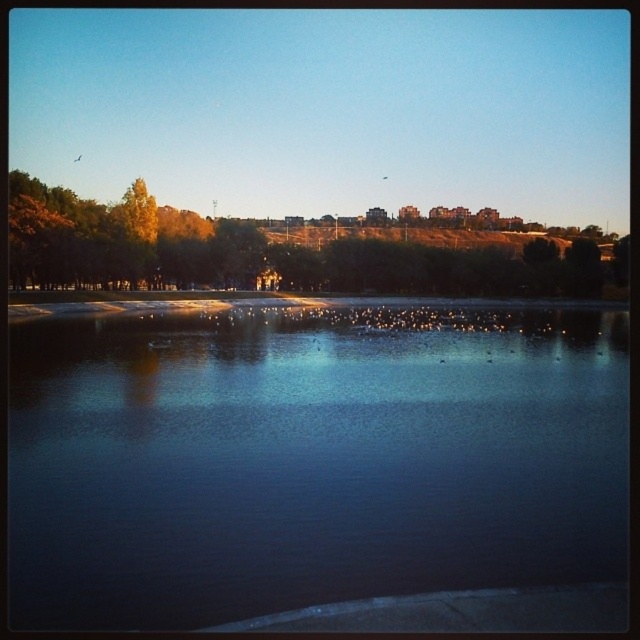
You are standing at the lakeside and want to take a photo that includes both the dark reflective water at center and the green leafy trees at upper center. Which object will appear closer to the top of your photo?

The green leafy trees at upper center will appear closer to the top of the photo because they are taller than the dark reflective water at center.

You are standing on the lakeside and want to take a photo of the dark reflective water at center and the green leafy trees at upper center. Which object is positioned to the left when framing both in your camera viewfinder?

The dark reflective water at center is positioned to the left of the green leafy trees at upper center in the camera viewfinder.